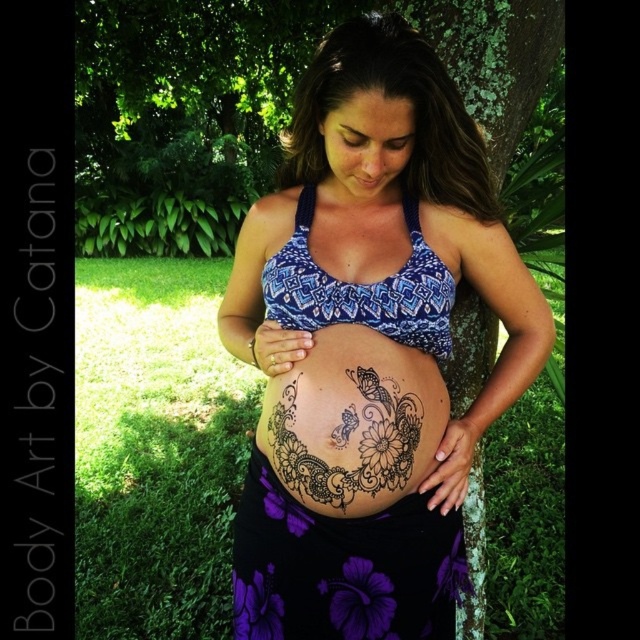
Can you confirm if matte blue bikini top at center is smaller than black henna tattoo at center?

Incorrect, matte blue bikini top at center is not smaller in size than black henna tattoo at center.

Who is more forward, [266,600] or [380,484]?

Point [380,484] is more forward.

Is point (316, 72) less distant than point (401, 404)?

Yes, point (316, 72) is closer to viewer.

You are a GUI agent. You are given a task and a screenshot of the screen. Output one action in this format:
    pyautogui.click(x=<x>, y=<y>)
    Task: Click on the matte blue bikini top at center
    The height and width of the screenshot is (640, 640).
    Given the screenshot: What is the action you would take?
    pyautogui.click(x=369, y=346)